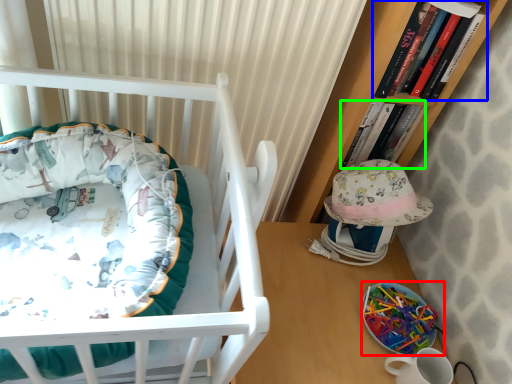
Question: Which is farther away from equipment (highlighted by a red box)? book (highlighted by a blue box) or book (highlighted by a green box)?

Choices:
 (A) book
 (B) book

Answer: (A)